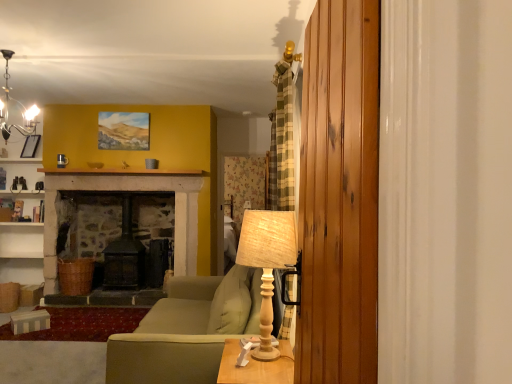
Question: From a real-world perspective, is green fabric couch at center physically above matte black picture frame at upper left?

Choices:
 (A) no
 (B) yes

Answer: (A)

Question: Is the depth of green fabric couch at center less than that of matte black picture frame at upper left?

Choices:
 (A) yes
 (B) no

Answer: (A)

Question: Is green fabric couch at center thinner than matte black picture frame at upper left?

Choices:
 (A) no
 (B) yes

Answer: (A)

Question: From the image's perspective, does green fabric couch at center appear lower than matte black picture frame at upper left?

Choices:
 (A) yes
 (B) no

Answer: (A)

Question: Can you confirm if green fabric couch at center is wider than matte black picture frame at upper left?

Choices:
 (A) yes
 (B) no

Answer: (A)

Question: Does green fabric couch at center appear on the left side of matte black picture frame at upper left?

Choices:
 (A) yes
 (B) no

Answer: (B)

Question: Is wooden table at lower center touching wooden table lamp at center?

Choices:
 (A) yes
 (B) no

Answer: (B)

Question: Is wooden table at lower center thinner than wooden table lamp at center?

Choices:
 (A) yes
 (B) no

Answer: (B)

Question: Does wooden table at lower center appear on the right side of wooden table lamp at center?

Choices:
 (A) yes
 (B) no

Answer: (B)

Question: Is wooden table at lower center outside of wooden table lamp at center?

Choices:
 (A) no
 (B) yes

Answer: (B)

Question: From a real-world perspective, is wooden table at lower center on wooden table lamp at center?

Choices:
 (A) yes
 (B) no

Answer: (B)

Question: Is wooden table lamp at center located within wooden table at lower center?

Choices:
 (A) yes
 (B) no

Answer: (B)

Question: Is matte black chandelier at upper left with wooden table at lower center?

Choices:
 (A) no
 (B) yes

Answer: (A)